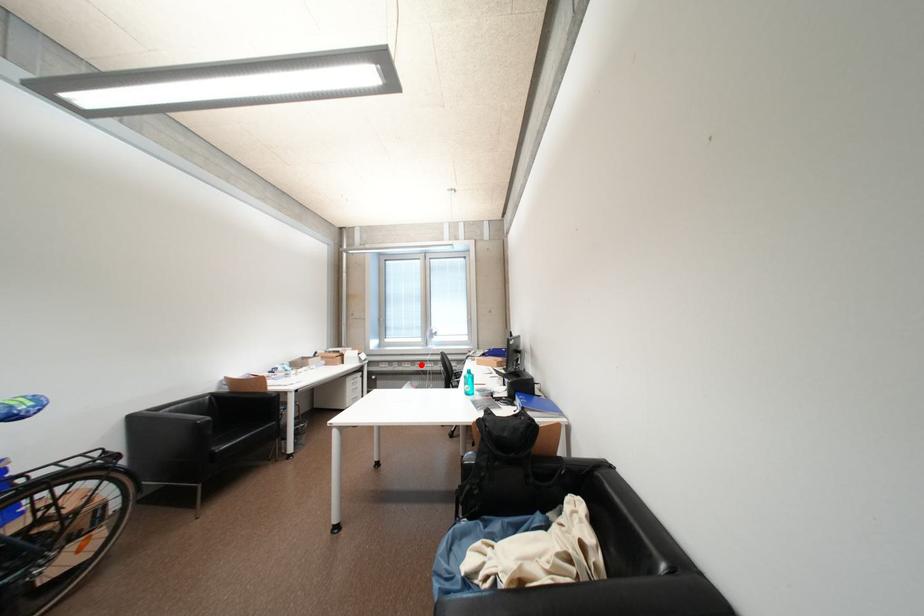
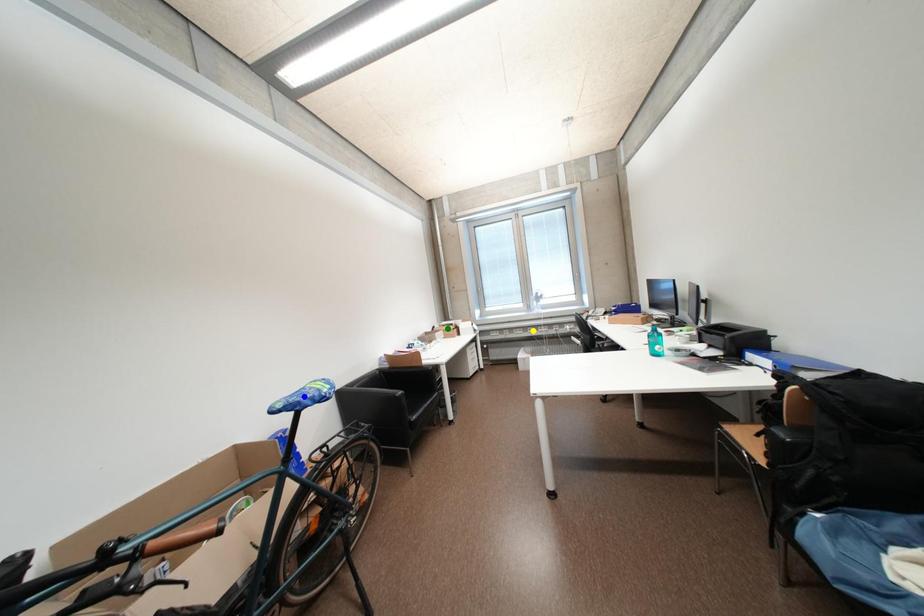
Question: I am providing you with two images of the same scene from different viewpoints. A red point is marked on the first image. You are given multiple points on the second image. Can you choose the point in image 2 that corresponds to the point in image 1?

Choices:
 (A) blue point
 (B) green point
 (C) yellow point

Answer: (C)